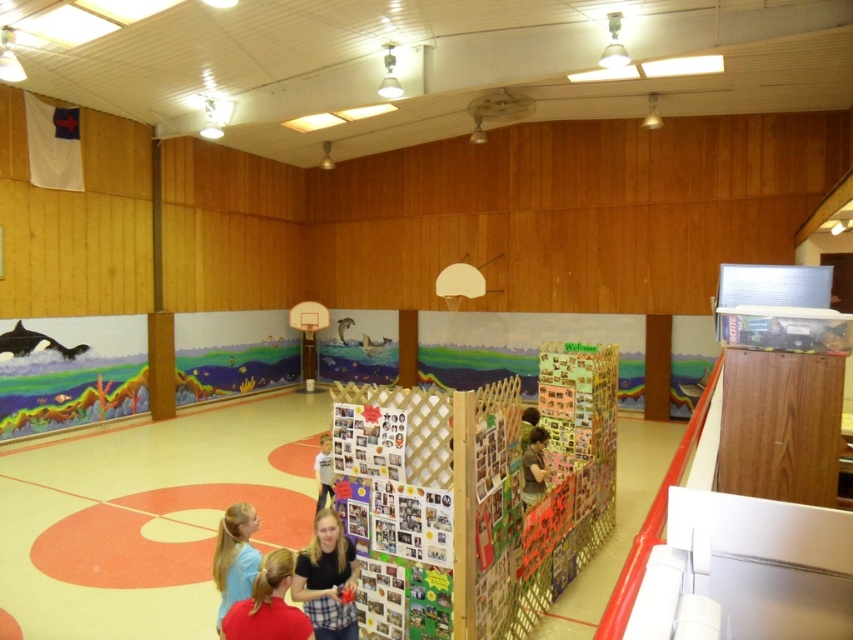
Question: Which object appears farthest from the camera in this image?

Choices:
 (A) light brown wooden frame at center
 (B) matte brown shirt at center
 (C) plaid shirt at center

Answer: (B)

Question: Which is farther from the matte brown shirt at center?

Choices:
 (A) blonde hair at lower left
 (B) plaid shirt at center
 (C) light brown wooden frame at center
 (D) red fabric shirt at lower center

Answer: (D)

Question: Is the position of blonde hair at lower left more distant than that of matte brown shirt at center?

Choices:
 (A) yes
 (B) no

Answer: (B)

Question: Considering the real-world distances, which object is farthest from the plaid shirt at center?

Choices:
 (A) light brown wooden frame at center
 (B) red fabric shirt at lower center
 (C) matte brown shirt at center

Answer: (C)

Question: Can you confirm if plaid shirt at center is smaller than red fabric shirt at lower center?

Choices:
 (A) yes
 (B) no

Answer: (B)

Question: Observing the image, what is the correct spatial positioning of red fabric shirt at lower center in reference to blonde hair at lower left?

Choices:
 (A) right
 (B) left

Answer: (A)